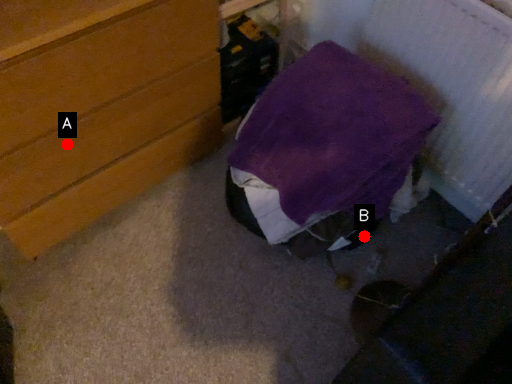
Question: Two points are circled on the image, labeled by A and B beside each circle. Which point is closer to the camera?

Choices:
 (A) A is closer
 (B) B is closer

Answer: (A)